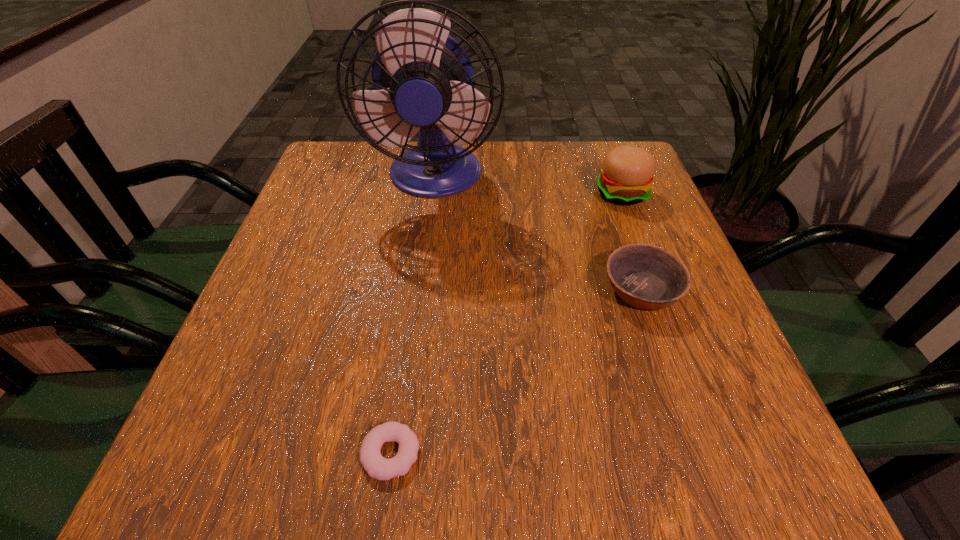
Where is `vacant space at the right edge of the desktop`? This screenshot has width=960, height=540. vacant space at the right edge of the desktop is located at coordinates (681, 309).

Image resolution: width=960 pixels, height=540 pixels. In order to click on vacant area at the far left corner of the desktop in this screenshot , I will do `click(367, 183)`.

In the image, there is a desktop. Identify the location of vacant region at the far right corner. (586, 151).

In the image, there is a desktop. Where is `vacant space at the near right corner`? This screenshot has height=540, width=960. vacant space at the near right corner is located at coordinates (775, 447).

Locate an element on the screen. empty space that is in between the hamburger and the tallest object is located at coordinates (528, 185).

This screenshot has height=540, width=960. What are the coordinates of `free space between the bowl and the nearest object` in the screenshot? It's located at (516, 372).

At what (x,y) coordinates should I click in order to perform the action: click on empty space that is in between the fan and the third shortest object. Please return your answer as a coordinate pair (x, y). Looking at the image, I should click on 528,185.

In order to click on free space between the second tallest object and the doughnut in this screenshot , I will do click(506, 323).

The height and width of the screenshot is (540, 960). I want to click on free space between the hamburger and the nearest object, so click(x=506, y=323).

At what (x,y) coordinates should I click in order to perform the action: click on free space between the nearest object and the third tallest object. Please return your answer as a coordinate pair (x, y). The height and width of the screenshot is (540, 960). Looking at the image, I should click on (516, 372).